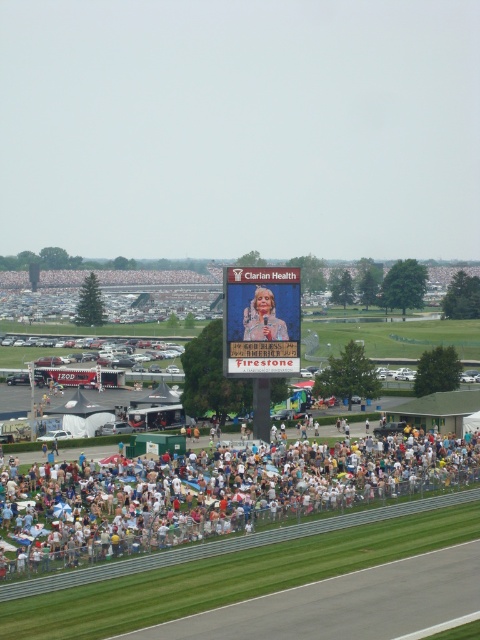
Can you confirm if matte black person at lower center is smaller than matte pink dress at center?

No.

Does matte black person at lower center have a greater width compared to matte pink dress at center?

Correct, the width of matte black person at lower center exceeds that of matte pink dress at center.

This screenshot has height=640, width=480. What are the coordinates of `matte black person at lower center` in the screenshot? It's located at (222, 493).

This screenshot has width=480, height=640. Find the location of `matte black person at lower center`. matte black person at lower center is located at coordinates (222, 493).